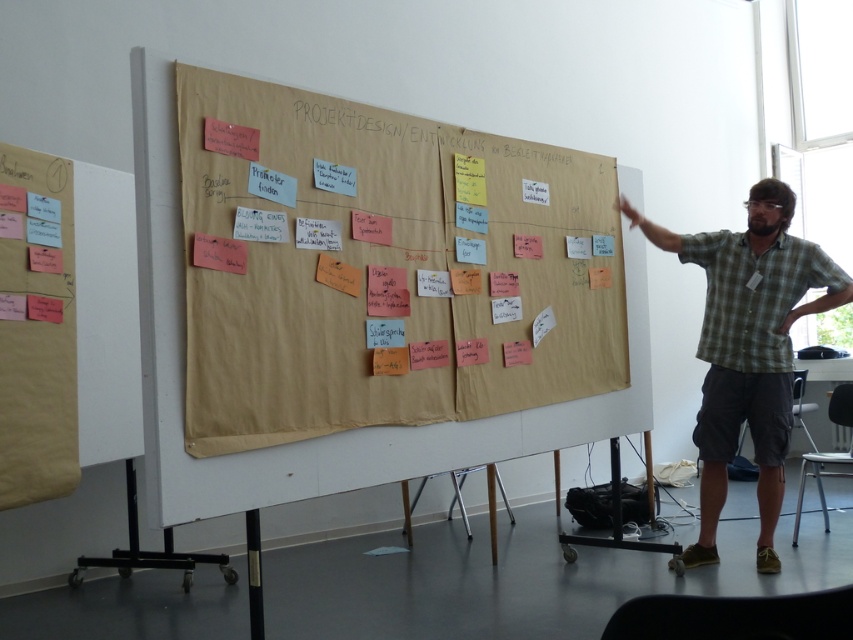
Question: Does brown paper at center have a smaller size compared to green plaid shirt at right?

Choices:
 (A) no
 (B) yes

Answer: (A)

Question: Estimate the real-world distances between objects in this image. Which object is farther from the white paper at center?

Choices:
 (A) brown paper at center
 (B) green plaid shirt at right

Answer: (B)

Question: Does brown paper at center have a greater width compared to white paper at center?

Choices:
 (A) yes
 (B) no

Answer: (A)

Question: Which of the following is the farthest from the observer?

Choices:
 (A) (730, 435)
 (B) (383, 131)

Answer: (A)

Question: Which object appears farthest from the camera in this image?

Choices:
 (A) white paper at center
 (B) brown paper at center
 (C) green plaid shirt at right

Answer: (C)

Question: Does brown paper at center appear on the left side of white paper at center?

Choices:
 (A) no
 (B) yes

Answer: (A)